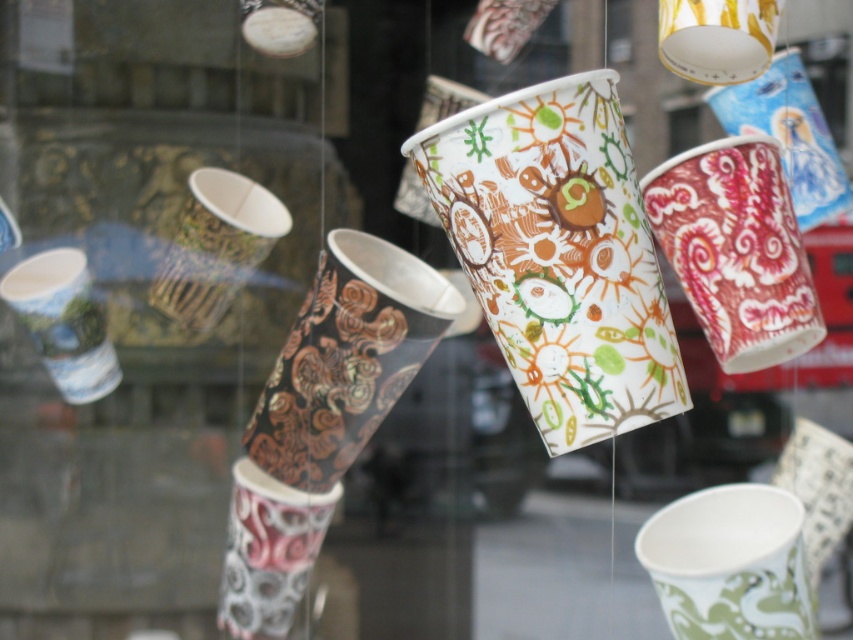
Does matte brown paper cup at center have a lesser width compared to matte paper cup at left?

Incorrect, matte brown paper cup at center's width is not less than matte paper cup at left's.

Who is more distant from viewer, (201, 196) or (32, 298)?

The point (32, 298) is behind.

This screenshot has width=853, height=640. What are the coordinates of `matte brown paper cup at center` in the screenshot? It's located at (215, 246).

Is brown paisley-patterned cup at right wider than matte paper cup at left?

Indeed, brown paisley-patterned cup at right has a greater width compared to matte paper cup at left.

Does point (737, 320) come behind point (64, 272)?

No, it is in front of (64, 272).

Who is more distant from viewer, [680,173] or [64,374]?

The point [64,374] is more distant.

Locate an element on the screen. The width and height of the screenshot is (853, 640). brown paisley-patterned cup at right is located at coordinates (735, 250).

How distant is multicolored paper cup at center from white paper cup at center?

multicolored paper cup at center is 15.12 inches from white paper cup at center.

Is multicolored paper cup at center to the left of white paper cup at center from the viewer's perspective?

Correct, you'll find multicolored paper cup at center to the left of white paper cup at center.

Who is more forward, (624, 308) or (770, 556)?

Point (624, 308) is more forward.

Where is `multicolored paper cup at center`? This screenshot has width=853, height=640. multicolored paper cup at center is located at coordinates click(558, 253).